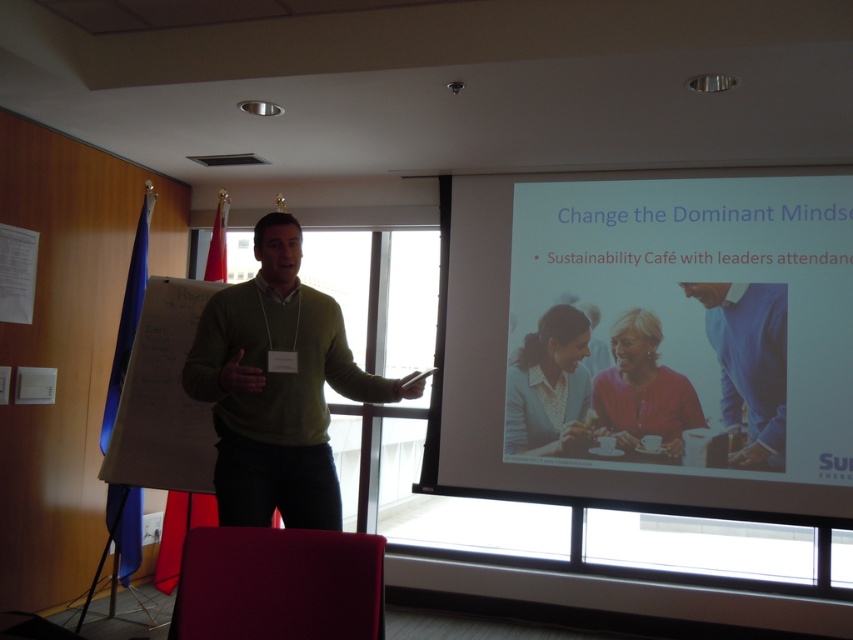
You are an assistant at a presentation. You need to place a small note on the presenter wearing a green sweater at center. Where should you place it so that it is exactly at the point with coordinates (277,387)?

The point with coordinates (277,387) is located on the green matte sweater at center, so you should place the note there.

You are an attendee at the presentation. You want to see the presenter clearly while also viewing the white glossy projector screen at upper center. Is the blue cotton shirt at center blocking your view of the screen?

The white glossy projector screen at upper center is in front of the blue cotton shirt at center, so the shirt is not blocking the view of the screen.

You are an attendee at the presentation and want to see both the blue cotton shirt at center and the white glossy projector screen at upper center clearly. Which one is located above the other?

The white glossy projector screen at upper center is positioned over the blue cotton shirt at center, so it is located above it.